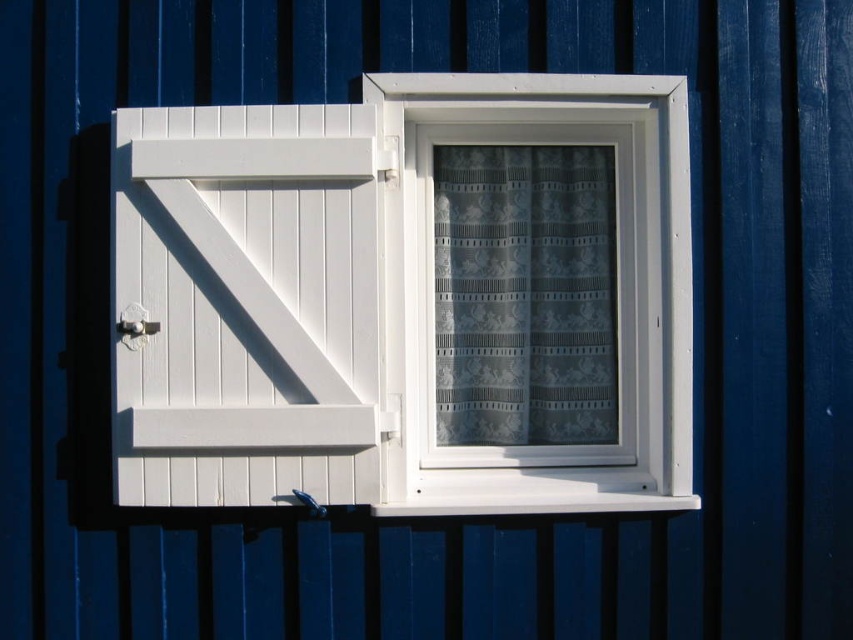
Does white wooden barn door at left come in front of white plastic window at center?

Yes, white wooden barn door at left is in front of white plastic window at center.

Can you confirm if white wooden barn door at left is wider than white plastic window at center?

No.

The width and height of the screenshot is (853, 640). What do you see at coordinates (247, 305) in the screenshot?
I see `white wooden barn door at left` at bounding box center [247, 305].

In order to click on white wooden barn door at left in this screenshot , I will do `click(247, 305)`.

Is white wooden barn door at left shorter than translucent lace curtain at center?

In fact, white wooden barn door at left may be taller than translucent lace curtain at center.

Which is more to the left, white wooden barn door at left or translucent lace curtain at center?

From the viewer's perspective, white wooden barn door at left appears more on the left side.

Find the location of a particular element. This screenshot has width=853, height=640. white wooden barn door at left is located at coordinates (247, 305).

The width and height of the screenshot is (853, 640). What do you see at coordinates (616, 289) in the screenshot?
I see `white plastic window at center` at bounding box center [616, 289].

Which of these two, white plastic window at center or translucent lace curtain at center, stands shorter?

translucent lace curtain at center is shorter.

Who is more forward, (407, 172) or (498, 419)?

Positioned in front is point (407, 172).

What are the coordinates of `white plastic window at center` in the screenshot? It's located at [616, 289].